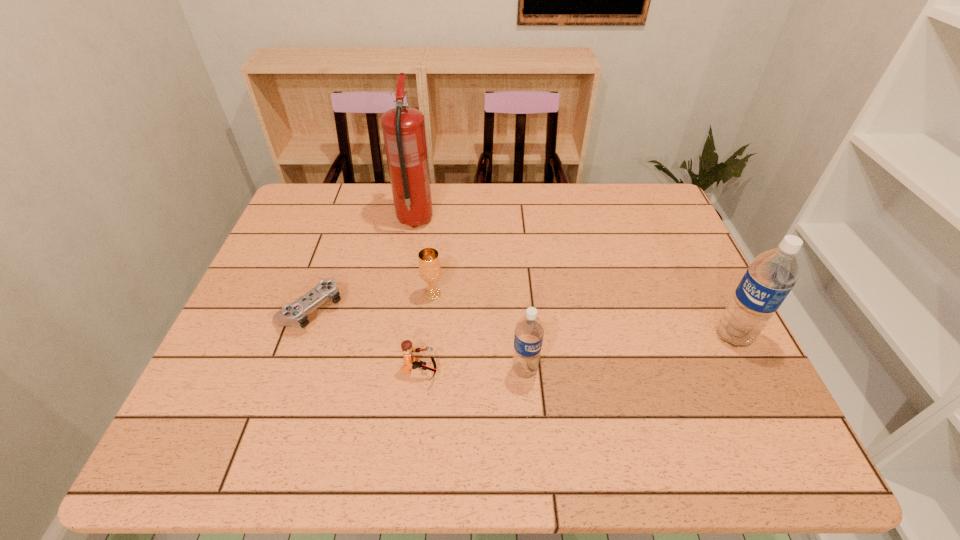
In the current image, all water bottles are evenly spaced. To maintain this equal spacing, where should an additional water bottle be placed on the left? Please point out a free spot. Please provide its 2D coordinates. Your answer should be formatted as a tuple, i.e. [(x, y)], where the tuple contains the x and y coordinates of a point satisfying the conditions above.

[(287, 408)]